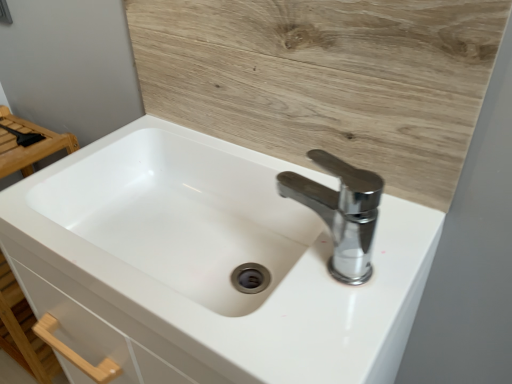
You are a GUI agent. You are given a task and a screenshot of the screen. Output one action in this format:
    pyautogui.click(x=<x>, y=<y>)
    Task: Click on the empty space that is to the right of chrome metallic faucet at upper right
    The height and width of the screenshot is (384, 512).
    Given the screenshot: What is the action you would take?
    pyautogui.click(x=399, y=235)